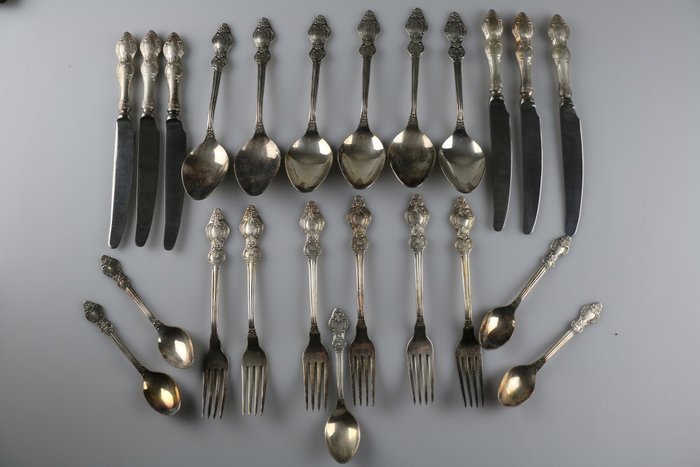
Locate an element on the screen. large spoons is located at coordinates (220, 157), (253, 163), (311, 160), (370, 162), (409, 161), (467, 157).